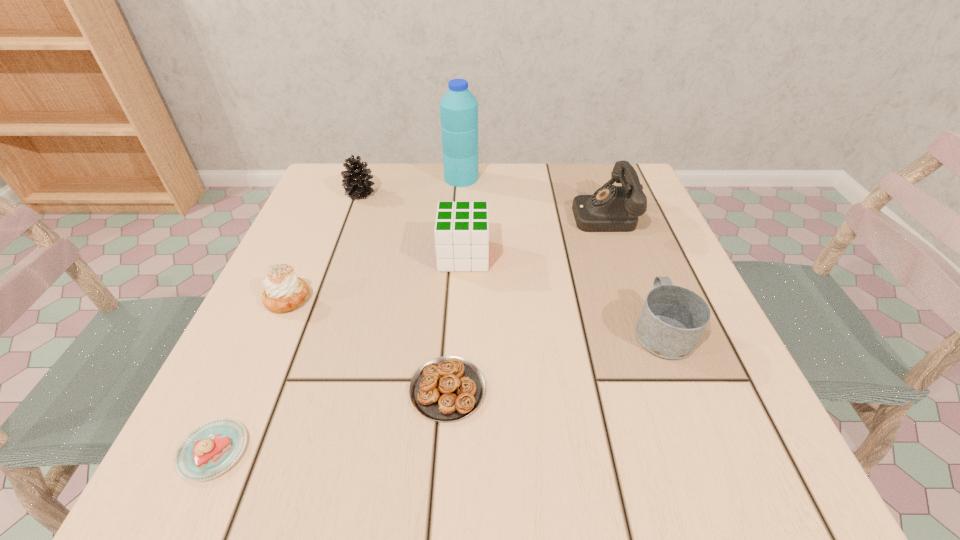
Where is `vacant space located on the dial of the telephone`? The width and height of the screenshot is (960, 540). vacant space located on the dial of the telephone is located at coordinates (455, 214).

This screenshot has height=540, width=960. What are the coordinates of `free location located on the dial of the telephone` in the screenshot? It's located at (500, 214).

Locate an element on the screen. vacant space located on the front of the pinecone is located at coordinates (340, 249).

You are a GUI agent. You are given a task and a screenshot of the screen. Output one action in this format:
    pyautogui.click(x=<x>, y=<y>)
    Task: Click on the vacant space located on the red face of the cube
    
    Given the screenshot: What is the action you would take?
    pyautogui.click(x=523, y=255)

Where is `blank space located on the side of the mug with the handle`? This screenshot has height=540, width=960. blank space located on the side of the mug with the handle is located at coordinates (642, 279).

Where is `free space located 0.150m on the side of the mug with the handle`? The image size is (960, 540). free space located 0.150m on the side of the mug with the handle is located at coordinates (630, 248).

Find the location of `free space located 0.230m on the side of the mug with the handle`. free space located 0.230m on the side of the mug with the handle is located at coordinates (621, 225).

The width and height of the screenshot is (960, 540). Identify the location of vacant point located 0.140m on the right of the tallest pastry. coord(389,299).

Identify the location of free space located on the left of the rightmost pastry. (227, 389).

Where is `free region located on the back of the shortest pastry`? Image resolution: width=960 pixels, height=540 pixels. free region located on the back of the shortest pastry is located at coordinates (309, 241).